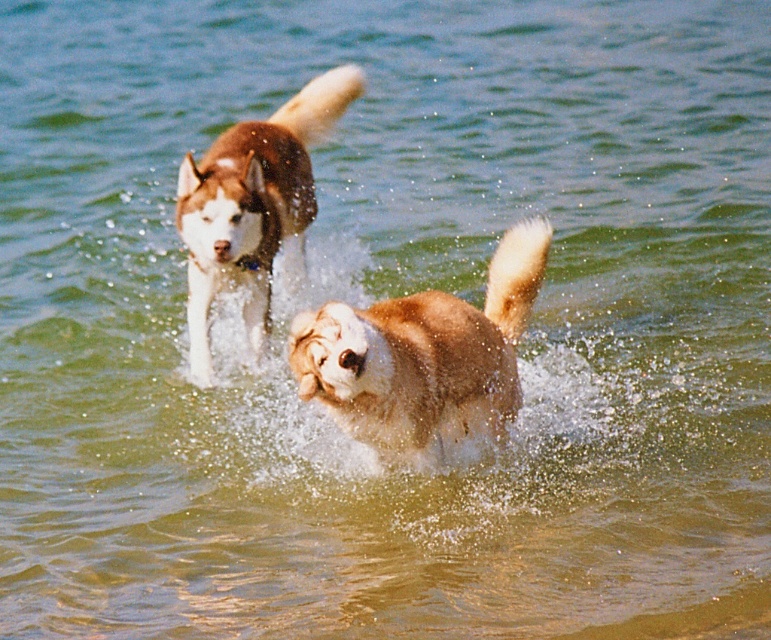
Question: Is fuzzy brown dog at center further to camera compared to brown fur dog at center?

Choices:
 (A) no
 (B) yes

Answer: (A)

Question: Does fuzzy brown dog at center appear on the left side of brown fur dog at center?

Choices:
 (A) no
 (B) yes

Answer: (A)

Question: Is fuzzy brown dog at center positioned behind brown fur dog at center?

Choices:
 (A) no
 (B) yes

Answer: (A)

Question: Which point is farther to the camera?

Choices:
 (A) fuzzy brown dog at center
 (B) brown fur dog at center

Answer: (B)

Question: Which object appears closest to the camera in this image?

Choices:
 (A) fuzzy brown dog at center
 (B) brown fur dog at center

Answer: (A)

Question: Among these objects, which one is nearest to the camera?

Choices:
 (A) fuzzy brown dog at center
 (B) brown fur dog at center

Answer: (A)